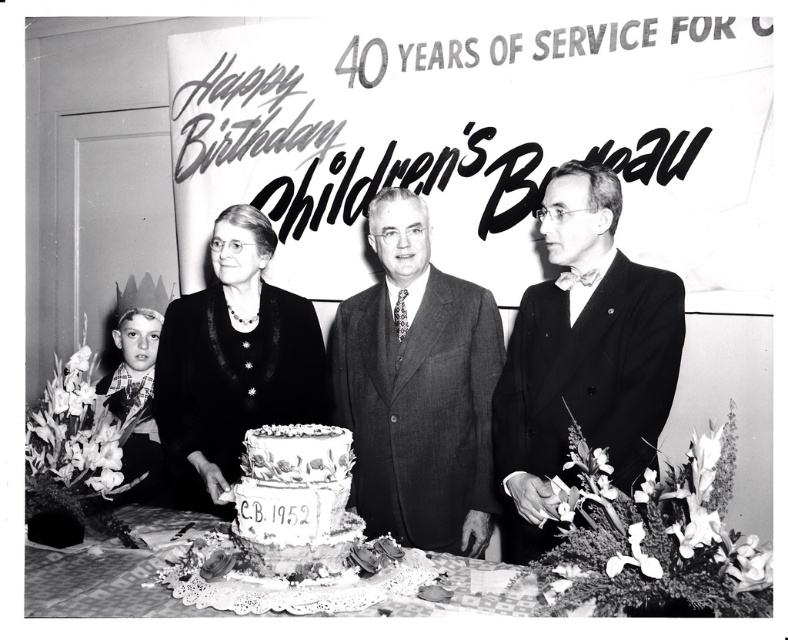
You are a photographer at the event and need to adjust the lighting so that both the smooth black suit at center and the white lace tablecloth at center are equally visible. Which object requires more light adjustment? Explain your reasoning.

The smooth black suit at center is bigger than the white lace tablecloth at center. Since the black suit is larger, it might require more light adjustment to ensure it doesn not appear too dark compared to the smaller white tablecloth, which reflects more light naturally.

You are a photographer at a 1952 event. You want to take a photo of the white frosted cake at center and the matte black dress at center. The camera you have can only focus on objects within 20 inches. Will both subjects be in focus?

The matte black dress at center is 20.29 inches from the white frosted cake at center. Since the camera can only focus within 20 inches, the distance between them exceeds the focus range, so both subjects may not be in focus simultaneously.